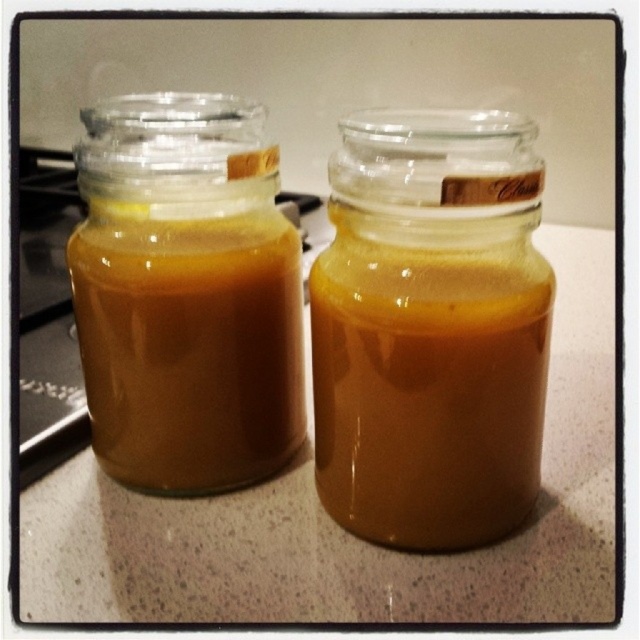
Is golden translucent liquid at center below golden translucent jar at left?

Correct, golden translucent liquid at center is located below golden translucent jar at left.

Consider the image. Can you confirm if golden translucent liquid at center is shorter than golden translucent jar at left?

Indeed, golden translucent liquid at center has a lesser height compared to golden translucent jar at left.

Describe the element at coordinates (428, 388) in the screenshot. The width and height of the screenshot is (640, 640). I see `golden translucent liquid at center` at that location.

You are a GUI agent. You are given a task and a screenshot of the screen. Output one action in this format:
    pyautogui.click(x=<x>, y=<y>)
    Task: Click on the golden translucent liquid at center
    This screenshot has height=640, width=640.
    Given the screenshot: What is the action you would take?
    pyautogui.click(x=428, y=388)